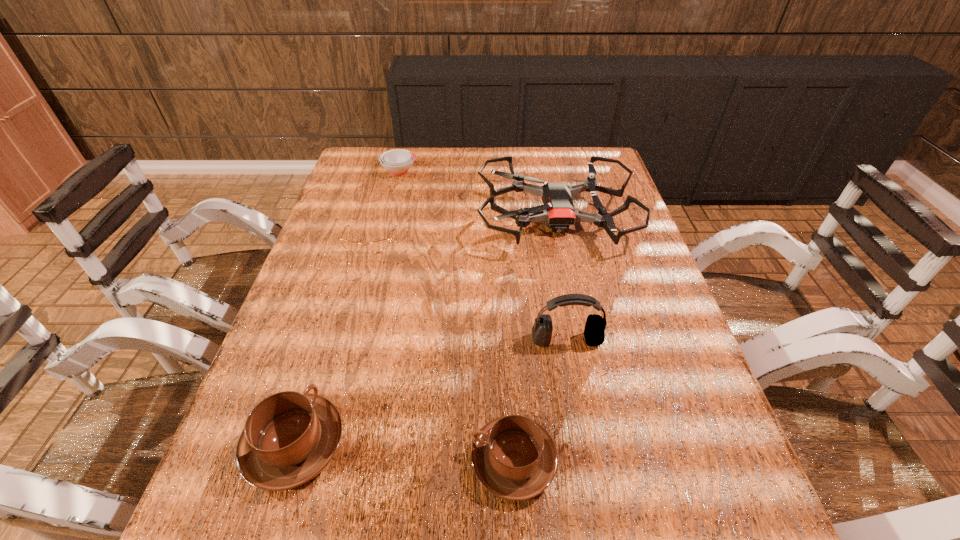
Image resolution: width=960 pixels, height=540 pixels. Identify the location of the taller cappuccino. (289, 437).

I want to click on the third shortest object, so click(514, 457).

This screenshot has height=540, width=960. In order to click on the right cappuccino in this screenshot , I will do `click(514, 457)`.

Identify the location of spectacles. The width and height of the screenshot is (960, 540). (378, 246).

The image size is (960, 540). Find the location of `soup bowl`. soup bowl is located at coordinates coord(397,162).

In order to click on the fifth tallest object in this screenshot , I will do `click(397, 162)`.

Where is `drone`? This screenshot has width=960, height=540. drone is located at coordinates (558, 211).

I want to click on the third nearest object, so click(594, 332).

I want to click on the tallest object, so click(594, 332).

The width and height of the screenshot is (960, 540). I want to click on vacant region located 0.100m on the side of the taller cappuccino with the handle, so click(x=322, y=359).